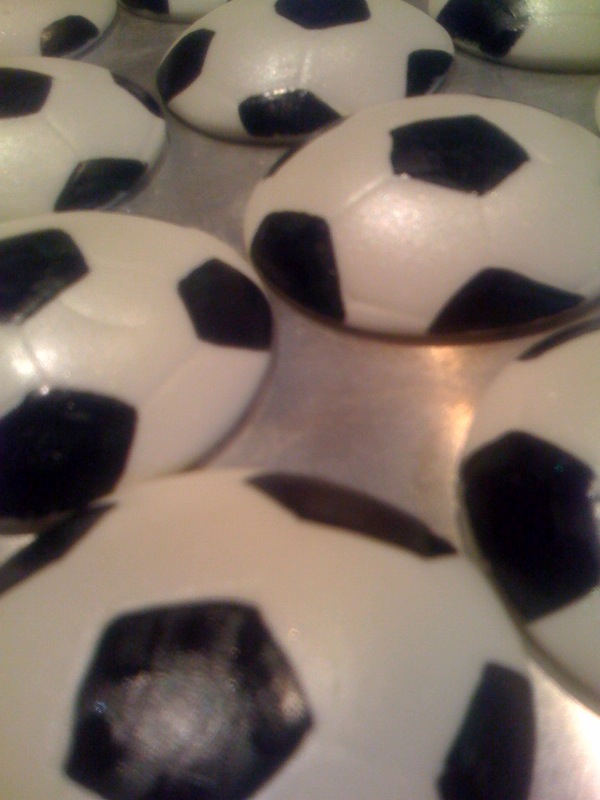
This screenshot has height=800, width=600. I want to click on floor, so click(359, 436).